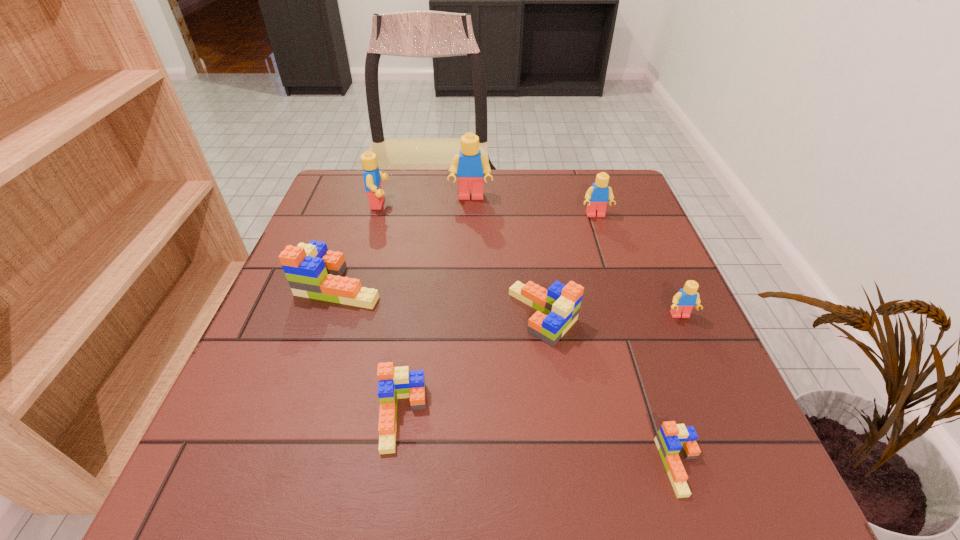
I want to click on the third biggest orange Lego, so click(x=394, y=383).

The image size is (960, 540). Identify the location of the second shortest object. (x=394, y=383).

Locate an element on the screen. The width and height of the screenshot is (960, 540). the rightmost orange Lego is located at coordinates (671, 438).

This screenshot has width=960, height=540. I want to click on the shortest Lego, so click(x=671, y=438).

This screenshot has height=540, width=960. Identify the location of vacant space located 0.200m on the front-facing side of the tallest object. (469, 252).

Locate an element on the screen. The image size is (960, 540). vacant region located on the front-facing side of the leftmost yellow Lego is located at coordinates pyautogui.click(x=444, y=204).

The height and width of the screenshot is (540, 960). I want to click on vacant space located on the front-facing side of the second yellow Lego from right to left, so click(618, 285).

Find the location of `vacant space located 0.060m on the front of the leftmost orange Lego`. vacant space located 0.060m on the front of the leftmost orange Lego is located at coordinates (324, 332).

Image resolution: width=960 pixels, height=540 pixels. Find the location of `vacant region located 0.160m on the back of the second biggest orange Lego`. vacant region located 0.160m on the back of the second biggest orange Lego is located at coordinates (533, 241).

This screenshot has width=960, height=540. What are the coordinates of `free point located 0.250m on the front-facing side of the nearest yellow Lego` in the screenshot? It's located at (735, 440).